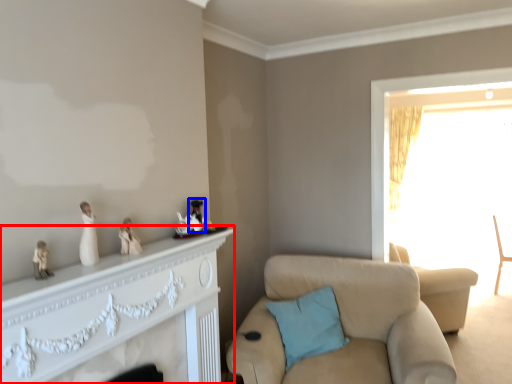
Question: Among these objects, which one is farthest to the camera, dresser (highlighted by a red box) or toy (highlighted by a blue box)?

Choices:
 (A) dresser
 (B) toy

Answer: (B)